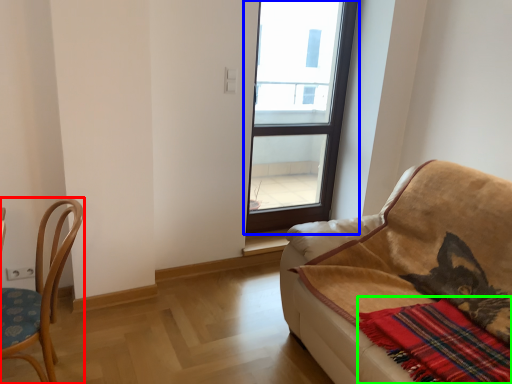
Question: Considering the real-world distances, which object is farthest from chair (highlighted by a red box)? window (highlighted by a blue box) or plaid (highlighted by a green box)?

Choices:
 (A) window
 (B) plaid

Answer: (A)